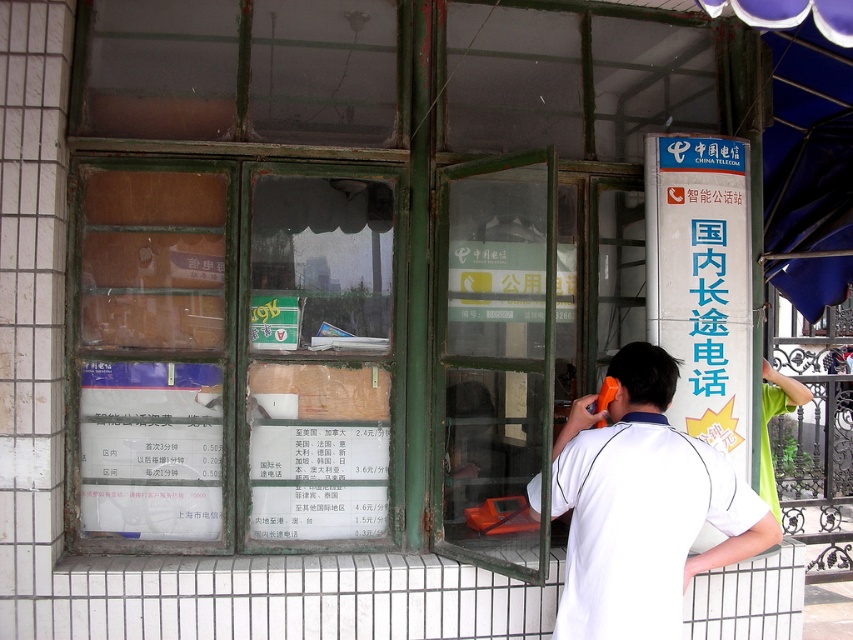
Question: Which of the following is the farthest from the observer?

Choices:
 (A) transparent glass window at center
 (B) white matte shirt at center

Answer: (A)

Question: Which point is closer to the camera taking this photo?

Choices:
 (A) (598, 541)
 (B) (231, 432)

Answer: (A)

Question: In this image, where is transparent glass window at center located relative to white matte shirt at center?

Choices:
 (A) left
 (B) right

Answer: (A)

Question: Is transparent glass window at center positioned at the back of white matte shirt at center?

Choices:
 (A) yes
 (B) no

Answer: (A)

Question: Which point appears closest to the camera in this image?

Choices:
 (A) [601, 540]
 (B) [354, 493]

Answer: (A)

Question: Can you confirm if transparent glass window at center is positioned to the right of white matte shirt at center?

Choices:
 (A) yes
 (B) no

Answer: (B)